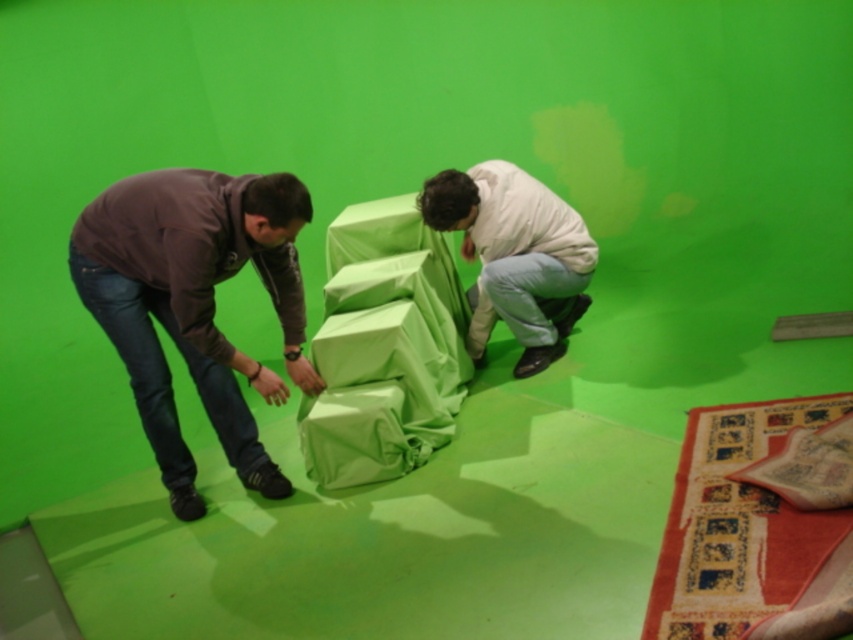
Can you confirm if matte brown hoodie at left is thinner than light beige fabric-covered object at center?

Indeed, matte brown hoodie at left has a lesser width compared to light beige fabric-covered object at center.

Which is below, matte brown hoodie at left or light beige fabric-covered object at center?

matte brown hoodie at left is below.

Which is in front, point (231, 458) or point (535, 228)?

Point (231, 458) is more forward.

The height and width of the screenshot is (640, 853). Identify the location of matte brown hoodie at left. (194, 305).